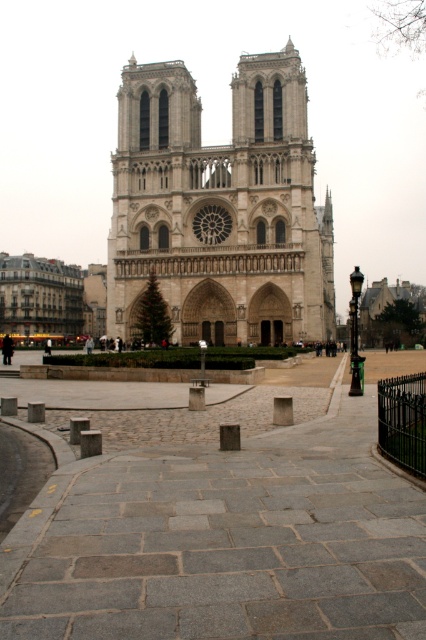
Can you confirm if gray stone plaza at center is shorter than stone gothic cathedral at center?

Indeed, gray stone plaza at center has a lesser height compared to stone gothic cathedral at center.

Between gray stone plaza at center and stone gothic cathedral at center, which one appears on the right side from the viewer's perspective?

Positioned to the right is gray stone plaza at center.

What are the coordinates of `gray stone plaza at center` in the screenshot? It's located at (224, 540).